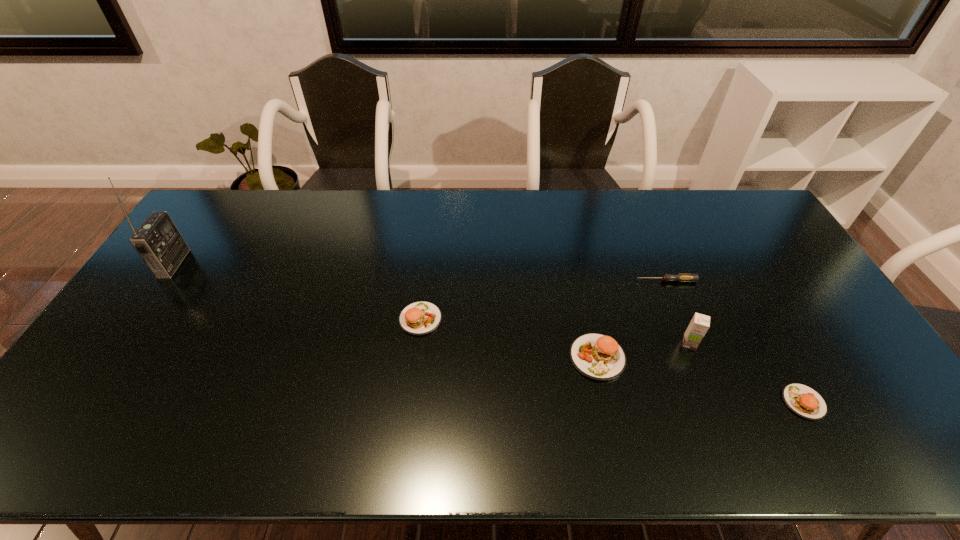
You are a GUI agent. You are given a task and a screenshot of the screen. Output one action in this format:
    pyautogui.click(x=<x>, y=<y>)
    Task: Click on the free area in between the fourth tallest object and the shortest object
    This screenshot has width=960, height=540.
    Given the screenshot: What is the action you would take?
    pyautogui.click(x=543, y=300)

In order to click on vacant area that lies between the leftmost object and the nearest patty in this screenshot , I will do `click(489, 333)`.

Locate an element on the screen. Image resolution: width=960 pixels, height=540 pixels. free space between the second patty from right to left and the rightmost object is located at coordinates (701, 380).

Find the location of a particular element. This screenshot has width=960, height=540. object identified as the closest to the tallest patty is located at coordinates 699,325.

The image size is (960, 540). Find the location of `object that is the second closest to the chocolate milk`. object that is the second closest to the chocolate milk is located at coordinates (804, 401).

Where is `the closest patty to the screwdriver`? the closest patty to the screwdriver is located at coordinates (599, 357).

At what (x,y) coordinates should I click in order to perform the action: click on the closest patty relative to the chocolate milk. Please return your answer as a coordinate pair (x, y). This screenshot has height=540, width=960. Looking at the image, I should click on (599, 357).

The image size is (960, 540). I want to click on free location that satisfies the following two spatial constraints: 1. insert the fifth tallest object into a screw head; 2. on the left side of the screwdriver, so click(x=714, y=402).

This screenshot has width=960, height=540. In order to click on free spot that satisfies the following two spatial constraints: 1. on the display of the second patty from left to right; 2. on the left side of the leftmost object in this screenshot , I will do `click(108, 357)`.

This screenshot has height=540, width=960. I want to click on vacant space that satisfies the following two spatial constraints: 1. on the display of the tallest object; 2. on the back side of the rightmost object, so click(78, 402).